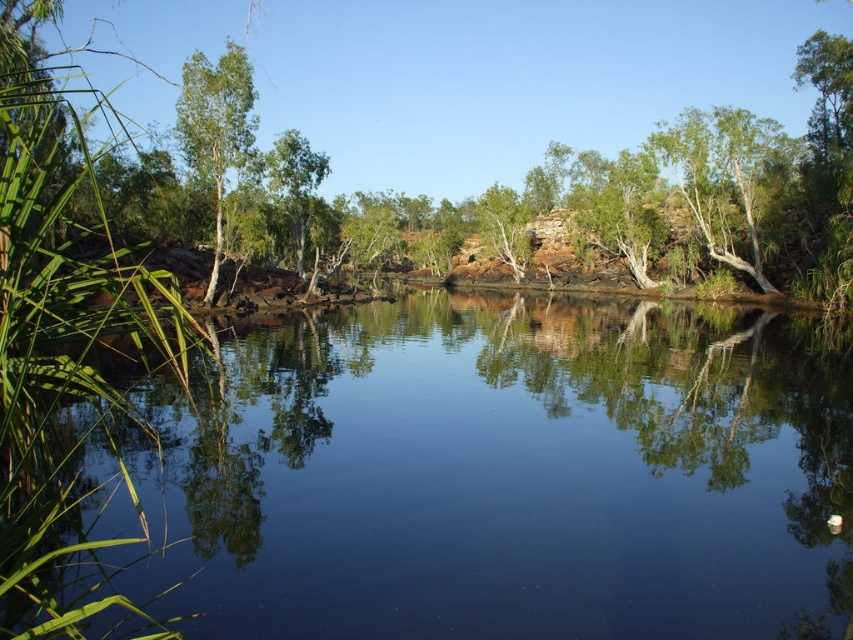
Question: Which object appears farthest from the camera in this image?

Choices:
 (A) green smooth tree at left
 (B) green leafy tree at center

Answer: (B)

Question: From the image, what is the correct spatial relationship of green smooth tree at left in relation to green leafy tree at center?

Choices:
 (A) below
 (B) above

Answer: (B)

Question: Which point is closer to the camera taking this photo?

Choices:
 (A) (293, 156)
 (B) (299, 470)
 (C) (206, 166)

Answer: (B)

Question: Which is nearer to the green leafy tree at center?

Choices:
 (A) green smooth tree at left
 (B) clear water at center

Answer: (A)

Question: Can you confirm if clear water at center is smaller than green smooth tree at left?

Choices:
 (A) no
 (B) yes

Answer: (B)

Question: Is green smooth tree at left behind green leafy tree at center?

Choices:
 (A) no
 (B) yes

Answer: (A)